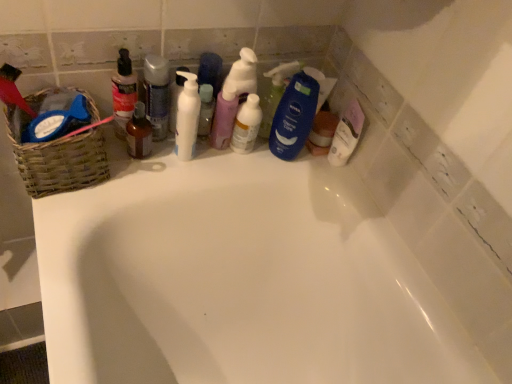
Question: Is pastel pink pump bottle at center, which ranks as the 2th cleaning product in left-to-right order, bigger than translucent plastic spray bottle at center, the second cleaning product viewed from the right?

Choices:
 (A) no
 (B) yes

Answer: (A)

Question: Is pastel pink pump bottle at center, which ranks as the 2th cleaning product in left-to-right order, looking in the opposite direction of translucent plastic spray bottle at center, the second cleaning product viewed from the right?

Choices:
 (A) no
 (B) yes

Answer: (A)

Question: Is pastel pink pump bottle at center, which ranks as the 2th cleaning product in left-to-right order, to the left of translucent plastic spray bottle at center, the second cleaning product viewed from the right, from the viewer's perspective?

Choices:
 (A) no
 (B) yes

Answer: (B)

Question: Considering the relative sizes of pastel pink pump bottle at center, the 3th cleaning product when ordered from right to left, and translucent plastic spray bottle at center, the second cleaning product viewed from the right, in the image provided, is pastel pink pump bottle at center, the 3th cleaning product when ordered from right to left, thinner than translucent plastic spray bottle at center, the second cleaning product viewed from the right,?

Choices:
 (A) no
 (B) yes

Answer: (B)

Question: Does pastel pink pump bottle at center, the 3th cleaning product when ordered from right to left, lie behind translucent plastic spray bottle at center, which is counted as the third cleaning product, starting from the left?

Choices:
 (A) no
 (B) yes

Answer: (A)

Question: Based on their positions, is translucent plastic bottle at upper left located to the left or right of white glossy bathtub at upper center?

Choices:
 (A) right
 (B) left

Answer: (B)

Question: Do you think translucent plastic bottle at upper left is within white glossy bathtub at upper center, or outside of it?

Choices:
 (A) outside
 (B) inside

Answer: (A)

Question: In terms of size, does translucent plastic bottle at upper left appear bigger or smaller than white glossy bathtub at upper center?

Choices:
 (A) big
 (B) small

Answer: (B)

Question: Looking at their shapes, would you say translucent plastic bottle at upper left is wider or thinner than white glossy bathtub at upper center?

Choices:
 (A) wide
 (B) thin

Answer: (B)

Question: Considering the positions of woven brown basket at left and translucent plastic spray bottle at center, which appears as the 4th cleaning product when viewed from the right, in the image, is woven brown basket at left wider or thinner than translucent plastic spray bottle at center, which appears as the 4th cleaning product when viewed from the right,?

Choices:
 (A) thin
 (B) wide

Answer: (B)

Question: Does point (x=37, y=99) appear closer or farther from the camera than point (x=166, y=114)?

Choices:
 (A) farther
 (B) closer

Answer: (B)

Question: In terms of height, does woven brown basket at left look taller or shorter compared to translucent plastic spray bottle at center, the first cleaning product in the left-to-right sequence?

Choices:
 (A) tall
 (B) short

Answer: (B)

Question: Considering the relative positions of woven brown basket at left and translucent plastic spray bottle at center, which appears as the 4th cleaning product when viewed from the right, in the image provided, is woven brown basket at left to the left or to the right of translucent plastic spray bottle at center, which appears as the 4th cleaning product when viewed from the right,?

Choices:
 (A) left
 (B) right

Answer: (A)

Question: Considering the positions of woven brown basket at left and translucent plastic spray bottle at center, the second cleaning product viewed from the right, in the image, is woven brown basket at left wider or thinner than translucent plastic spray bottle at center, the second cleaning product viewed from the right,?

Choices:
 (A) wide
 (B) thin

Answer: (A)

Question: Is woven brown basket at left bigger or smaller than translucent plastic spray bottle at center, which is counted as the third cleaning product, starting from the left?

Choices:
 (A) small
 (B) big

Answer: (B)